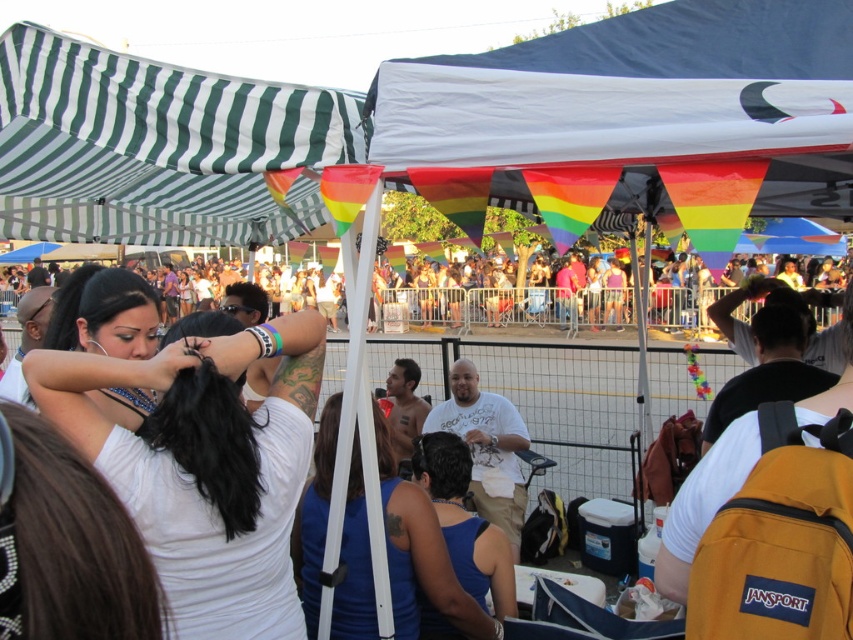
Question: Is smooth black hair at center above blue matte tank top at center?

Choices:
 (A) yes
 (B) no

Answer: (A)

Question: Which object is the closest to the smooth black hair at center?

Choices:
 (A) multicolored fabric crowd at center
 (B) blue matte tank top at center

Answer: (B)

Question: Does smooth black hair at center have a larger size compared to multicolored fabric crowd at center?

Choices:
 (A) no
 (B) yes

Answer: (A)

Question: Based on their relative distances, which object is nearer to the blue matte tank top at center?

Choices:
 (A) smooth black hair at center
 (B) multicolored fabric crowd at center

Answer: (A)

Question: From the image, what is the correct spatial relationship of blue matte tank top at center in relation to multicolored fabric crowd at center?

Choices:
 (A) below
 (B) above

Answer: (A)

Question: Estimate the real-world distances between objects in this image. Which object is closer to the multicolored fabric crowd at center?

Choices:
 (A) blue matte tank top at center
 (B) smooth black hair at center

Answer: (A)